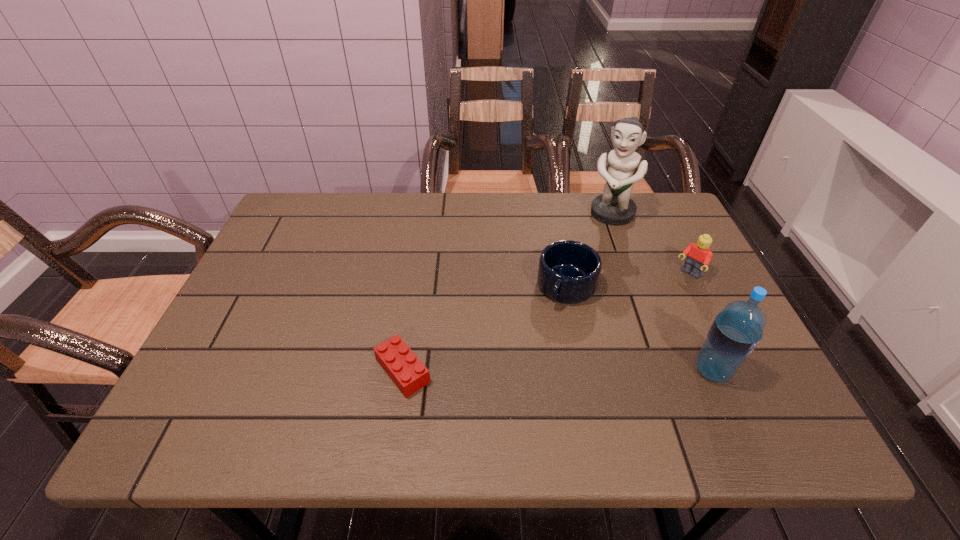
The height and width of the screenshot is (540, 960). What are the coordinates of `free area in between the left Lego and the fourth object from right to left` in the screenshot? It's located at (485, 329).

The height and width of the screenshot is (540, 960). In order to click on unoccupied position between the shorter Lego and the third tallest object in this screenshot , I will do `click(545, 323)`.

Choose which object is the second nearest neighbor to the leftmost object. Please provide its 2D coordinates. Your answer should be formatted as a tuple, i.e. [(x, y)], where the tuple contains the x and y coordinates of a point satisfying the conditions above.

[(737, 329)]

Locate an element on the screen. the closest object to the tallest object is located at coordinates (568, 272).

Where is `vacant position in the image that satisfies the following two spatial constraints: 1. on the back side of the fourth object from right to left; 2. on the left side of the shorter Lego`? Image resolution: width=960 pixels, height=540 pixels. vacant position in the image that satisfies the following two spatial constraints: 1. on the back side of the fourth object from right to left; 2. on the left side of the shorter Lego is located at coordinates (416, 287).

Locate an element on the screen. vacant position in the image that satisfies the following two spatial constraints: 1. on the back side of the mug; 2. on the left side of the figurine is located at coordinates (552, 214).